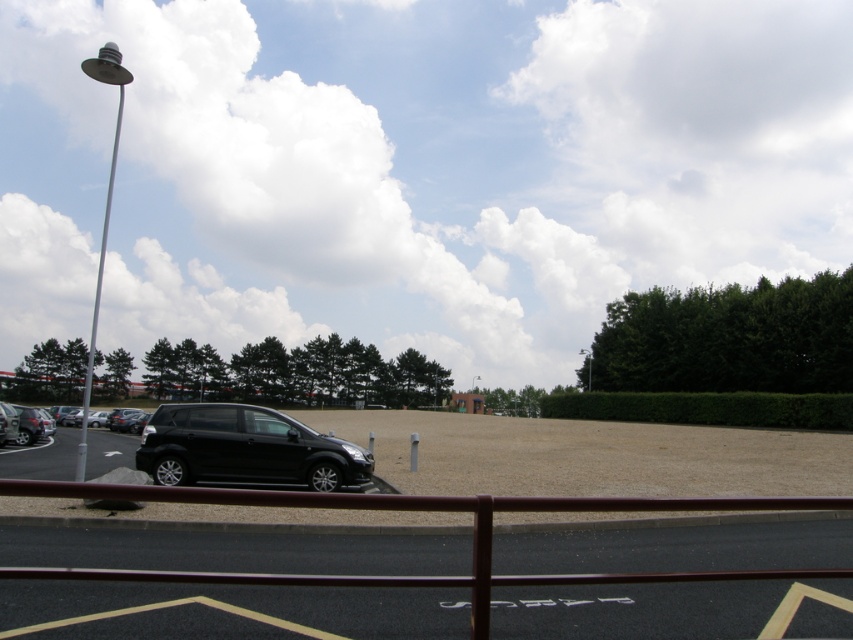
You are a delivery driver who needs to park your truck between the black matte suv at center and the shiny black suv at left. Can your truck, which is 2.5 meters wide, fit in the space between them?

The black matte suv at center has a lesser width compared to the shiny black suv at left, so the space between them may vary. However, since the shiny black suv at left is wider, the available space between the two SUVs might be narrower than the truck requires. Without exact spacing details, it is uncertain if the truck can fit.

You are a delivery driver who needs to park your truck, which is 2 meters wide, in the parking lot. Based on the scene, can your truck fit between the black asphalt parking lot at lower center and the black matte suv at center?

The black asphalt parking lot at lower center is thinner than the black matte suv at center, which means the space between them is narrower than 2 meters. Therefore, your truck cannot fit between them.

You are standing at point A located at coordinates (234, 550). What surface are you standing on?

You are standing on the black asphalt parking lot at lower center.